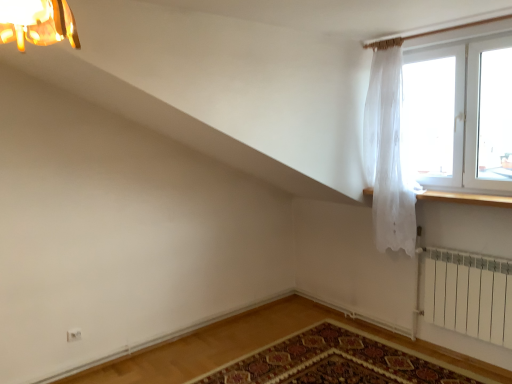
Identify the location of carpeted mat at lower center. This screenshot has width=512, height=384. (336, 362).

At what (x,y) coordinates should I click in order to perform the action: click on transparent glass window at upper right. Please return your answer as a coordinate pair (x, y). Looking at the image, I should click on (450, 112).

Find the location of a particular element. white sheer curtain at upper right is located at coordinates (388, 152).

Is wooden at right located within white sheer curtain at upper right?

No, wooden at right is not a part of white sheer curtain at upper right.

Are white sheer curtain at upper right and wooden at right beside each other?

No, white sheer curtain at upper right is not next to wooden at right.

Between white sheer curtain at upper right and wooden at right, which one has smaller size?

Smaller between the two is wooden at right.

From the image's perspective, is white sheer curtain at upper right above or below wooden at right?

Based on their image positions, white sheer curtain at upper right is located above wooden at right.

Which of these two, carpeted mat at lower center or white sheer curtain at upper right, stands shorter?

Standing shorter between the two is carpeted mat at lower center.

Is carpeted mat at lower center to the left of white sheer curtain at upper right from the viewer's perspective?

Correct, you'll find carpeted mat at lower center to the left of white sheer curtain at upper right.

Does point (451, 371) come in front of point (392, 133)?

Yes.

Which of these two, carpeted mat at lower center or white sheer curtain at upper right, is thinner?

white sheer curtain at upper right.

Can you confirm if transparent glass window at upper right is taller than wooden at right?

Yes, transparent glass window at upper right is taller than wooden at right.

Which point is more distant from viewer, [396,38] or [496,198]?

The point [396,38] is farther.

Does transparent glass window at upper right lie behind wooden at right?

That is True.

Does point (407, 359) appear closer or farther from the camera than point (504, 197)?

Point (407, 359).

Could you tell me if carpeted mat at lower center is facing wooden at right?

No, carpeted mat at lower center is not oriented towards wooden at right.

Where is `window sill that appears above the carpeted mat at lower center (from a real-world perspective)`? The height and width of the screenshot is (384, 512). window sill that appears above the carpeted mat at lower center (from a real-world perspective) is located at coordinates (464, 197).

Based on the photo, does carpeted mat at lower center appear on the left side of wooden at right?

Indeed, carpeted mat at lower center is positioned on the left side of wooden at right.

Considering the relative sizes of wooden at right and transparent glass window at upper right in the image provided, is wooden at right wider than transparent glass window at upper right?

Correct, the width of wooden at right exceeds that of transparent glass window at upper right.

Which is correct: wooden at right is inside transparent glass window at upper right, or outside of it?

wooden at right is located beyond the bounds of transparent glass window at upper right.

Considering the relative positions of wooden at right and transparent glass window at upper right in the image provided, is wooden at right to the left of transparent glass window at upper right from the viewer's perspective?

Yes.

From the image's perspective, is wooden at right located beneath transparent glass window at upper right?

Indeed, from the image's perspective, wooden at right is shown beneath transparent glass window at upper right.

Can you confirm if white sheer curtain at upper right is shorter than carpeted mat at lower center?

In fact, white sheer curtain at upper right may be taller than carpeted mat at lower center.

From the image's perspective, who appears lower, white sheer curtain at upper right or carpeted mat at lower center?

carpeted mat at lower center.

Between white sheer curtain at upper right and carpeted mat at lower center, which one appears on the left side from the viewer's perspective?

From the viewer's perspective, carpeted mat at lower center appears more on the left side.

Does white sheer curtain at upper right have a lesser width compared to carpeted mat at lower center?

Yes, white sheer curtain at upper right is thinner than carpeted mat at lower center.

Based on the photo, based on their positions, is transparent glass window at upper right located to the left or right of white sheer curtain at upper right?

transparent glass window at upper right is positioned on white sheer curtain at upper right's right side.

Looking at their sizes, would you say transparent glass window at upper right is wider or thinner than white sheer curtain at upper right?

Considering their sizes, transparent glass window at upper right looks slimmer than white sheer curtain at upper right.

From a real-world perspective, does transparent glass window at upper right sit lower than white sheer curtain at upper right?

No, from a real-world perspective, transparent glass window at upper right is not below white sheer curtain at upper right.

Is transparent glass window at upper right positioned far away from white sheer curtain at upper right?

Actually, transparent glass window at upper right and white sheer curtain at upper right are a little close together.

Locate an element on the screen. The width and height of the screenshot is (512, 384). window sill beneath the white sheer curtain at upper right (from a real-world perspective) is located at coordinates coord(464,197).

Where is `curtain on the right of carpeted mat at lower center`? This screenshot has height=384, width=512. curtain on the right of carpeted mat at lower center is located at coordinates (388, 152).

Which object lies nearer to the anchor point transparent glass window at upper right, white sheer curtain at upper right or carpeted mat at lower center?

white sheer curtain at upper right lies closer to transparent glass window at upper right than the other object.

Which object lies further to the anchor point white sheer curtain at upper right, carpeted mat at lower center or wooden at right?

carpeted mat at lower center is positioned further to the anchor white sheer curtain at upper right.

Considering their positions, is carpeted mat at lower center positioned closer to wooden at right than white sheer curtain at upper right?

The object closer to wooden at right is white sheer curtain at upper right.

Looking at the image, which one is located closer to transparent glass window at upper right, white sheer curtain at upper right or wooden at right?

Based on the image, white sheer curtain at upper right appears to be nearer to transparent glass window at upper right.

When comparing their distances from transparent glass window at upper right, does carpeted mat at lower center or wooden at right seem closer?

wooden at right is positioned closer to the anchor transparent glass window at upper right.

Based on their spatial positions, is white sheer curtain at upper right or carpeted mat at lower center closer to wooden at right?

white sheer curtain at upper right.

From the image, which object appears to be farther from wooden at right, white sheer curtain at upper right or transparent glass window at upper right?

white sheer curtain at upper right.

Which object lies nearer to the anchor point carpeted mat at lower center, transparent glass window at upper right or white sheer curtain at upper right?

Based on the image, white sheer curtain at upper right appears to be nearer to carpeted mat at lower center.

Where is `curtain that lies between transparent glass window at upper right and carpeted mat at lower center from top to bottom`? curtain that lies between transparent glass window at upper right and carpeted mat at lower center from top to bottom is located at coordinates (388, 152).

The height and width of the screenshot is (384, 512). I want to click on curtain between transparent glass window at upper right and wooden at right in the vertical direction, so click(x=388, y=152).

The height and width of the screenshot is (384, 512). Find the location of `window sill between transparent glass window at upper right and carpeted mat at lower center in the up-down direction`. window sill between transparent glass window at upper right and carpeted mat at lower center in the up-down direction is located at coordinates (464, 197).

Where is `window sill between white sheer curtain at upper right and carpeted mat at lower center from top to bottom`? window sill between white sheer curtain at upper right and carpeted mat at lower center from top to bottom is located at coordinates (464, 197).